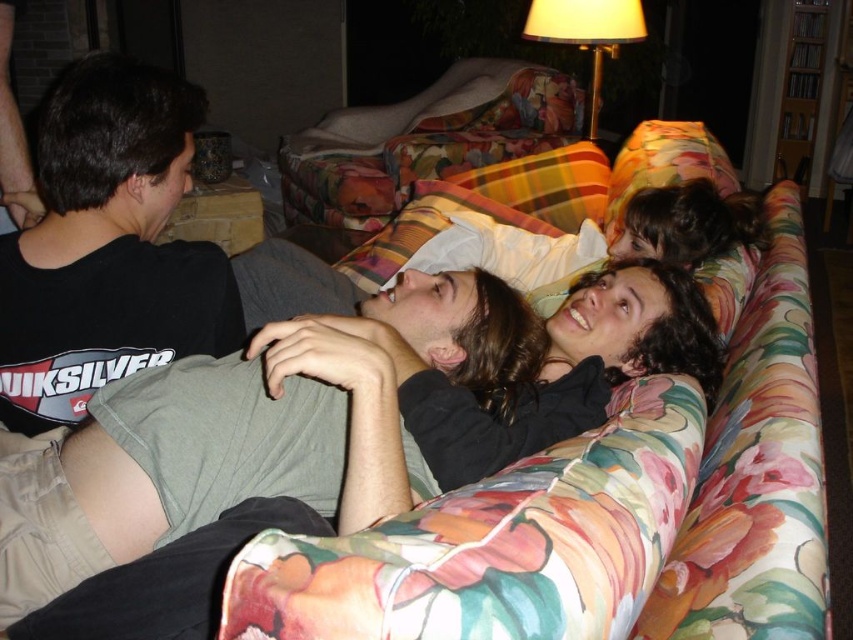
You are a photographer standing in front of the couch. You want to take a closeup shot of the black soft hair at center without moving the camera. Is it possible to do so with your current position?

The black soft hair at center is 83.20 centimeters from viewer, so if your camera can zoom sufficiently, you can take a closeup shot without moving closer.

You are a photographer setting up a shoot in this living room. You want to place a new floor lamp with a wide base next to the floral fabric couch at center. Considering the space between the couch and the metallic gold lampshade at upper right, will the floor lamp fit without blocking the lampshade?

The floral fabric couch at center is below the metallic gold lampshade at upper right, so placing a floor lamp next to the couch would not block the lampshade as they are positioned vertically apart.

Looking at this image, you are a photographer setting up a shoot in this living room. You want to place a small prop between the black soft hair at center and the metallic gold lampshade at upper right. Based on their positions, where should you place the prop?

The prop should be placed between the black soft hair at center and the metallic gold lampshade at upper right, positioning it below the lampshade and above the hair since the hair is below the lampshade.